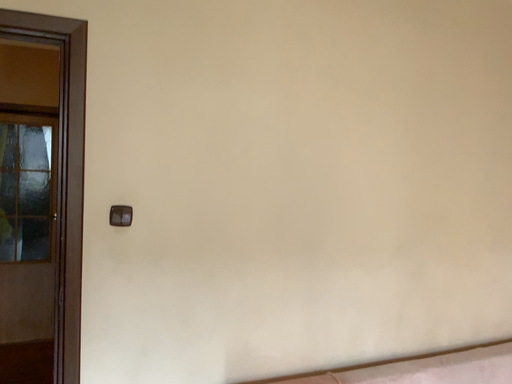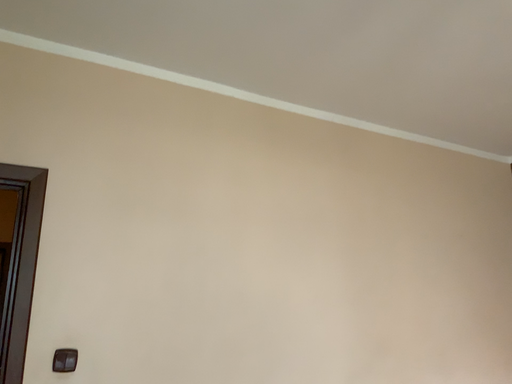
Question: How did the camera likely rotate when shooting the video?

Choices:
 (A) rotated downward
 (B) rotated upward

Answer: (B)